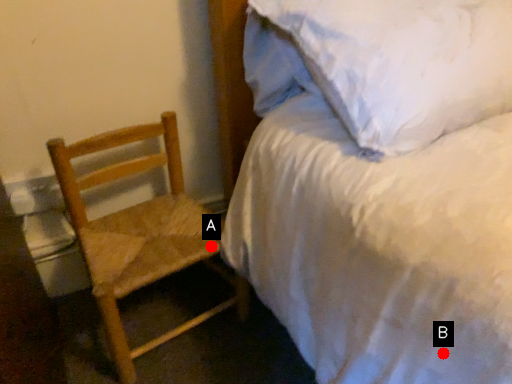
Question: Two points are circled on the image, labeled by A and B beside each circle. Which point appears closest to the camera in this image?

Choices:
 (A) A is closer
 (B) B is closer

Answer: (B)